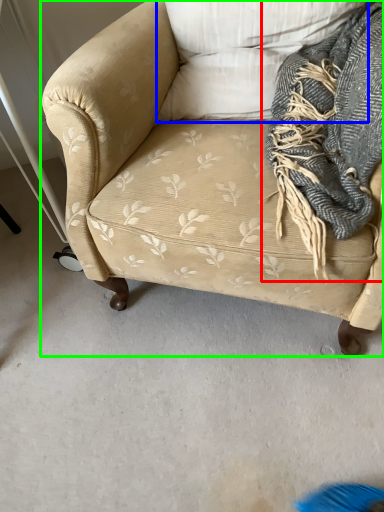
Question: Estimate the real-world distances between objects in this image. Which object is farther from scarf (highlighted by a red box), pillow (highlighted by a blue box) or studio couch (highlighted by a green box)?

Choices:
 (A) pillow
 (B) studio couch

Answer: (B)